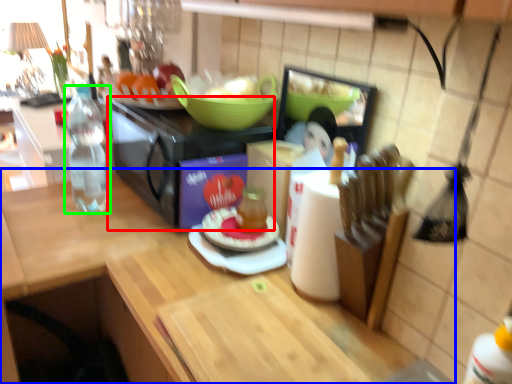
Question: Considering the real-world distances, which object is farthest from appliance (highlighted by a red box)? countertop (highlighted by a blue box) or bottle (highlighted by a green box)?

Choices:
 (A) countertop
 (B) bottle

Answer: (A)